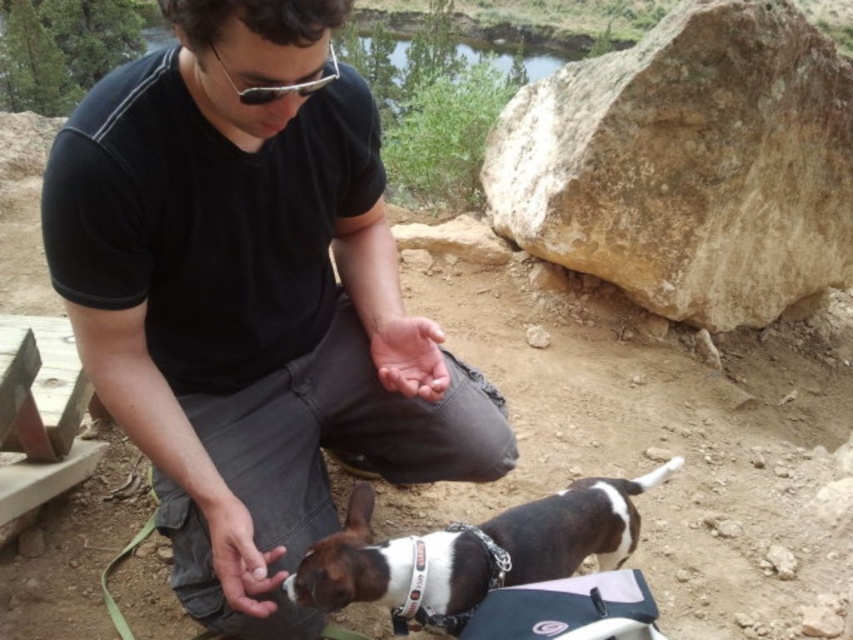
You are a hiker who wants to place a 15 cm wide snack box between the brown rough rock at upper right and the white and brown fur at lower center. Can you fit the snack box there?

The brown rough rock at upper right might be wider than white and brown fur at lower center, so there might be enough space to fit the 15 cm wide snack box between them.

You are a hiker who needs to know the position of the white and brown fur at lower center relative to the matte black goggles at upper center. Which one is higher?

The white and brown fur at lower center is located below matte black goggles at upper center, so the matte black goggles at upper center is higher.

You are a photographer trying to capture a photo of the black cotton shirt at center and the white and brown fur at lower center. Which object should you zoom in on to ensure both are in frame without moving the camera?

You should zoom in on the white and brown fur at lower center because the black cotton shirt at center is wider than the white and brown fur at lower center, so zooming in on the smaller object will keep both in frame.